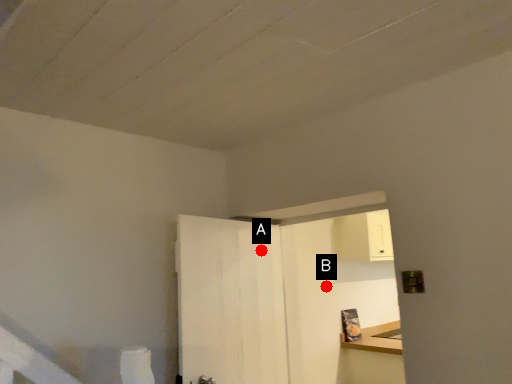
Question: Two points are circled on the image, labeled by A and B beside each circle. Among these points, which one is farthest from the camera?

Choices:
 (A) A is further
 (B) B is further

Answer: (B)